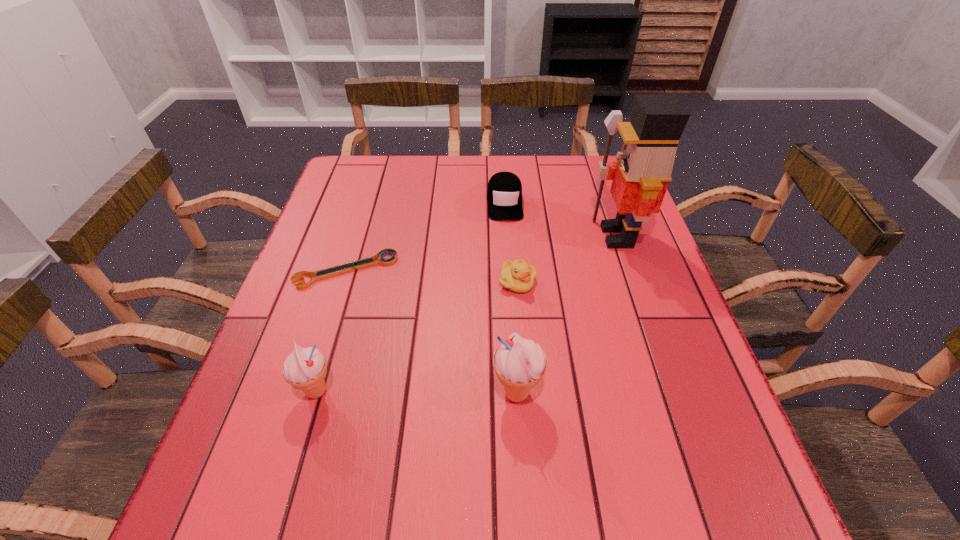
Locate an element on the screen. This screenshot has height=540, width=960. wrench at the left edge is located at coordinates (351, 266).

Identify the location of object that is at the right edge. The image size is (960, 540). (641, 175).

In the image, there is a desktop. What are the coordinates of `vacant space at the far edge` in the screenshot? It's located at (439, 183).

Find the location of `free space at the near edge`. free space at the near edge is located at coordinates (621, 448).

This screenshot has height=540, width=960. I want to click on blank area at the left edge, so click(332, 300).

You are a GUI agent. You are given a task and a screenshot of the screen. Output one action in this format:
    pyautogui.click(x=<x>, y=<y>)
    Task: Click on the vacant space at the far left corner of the desktop
    The height and width of the screenshot is (540, 960).
    Given the screenshot: What is the action you would take?
    pyautogui.click(x=376, y=168)

Find the location of a particular element. This screenshot has width=960, height=540. vacant space at the near left corner of the desktop is located at coordinates (306, 449).

The image size is (960, 540). In order to click on free space at the near right corner in this screenshot , I will do `click(728, 434)`.

Identify the location of vacant area that lies between the cap and the fifth shortest object. (511, 298).

Where is `free space between the cap and the right icecream`? This screenshot has width=960, height=540. free space between the cap and the right icecream is located at coordinates (511, 298).